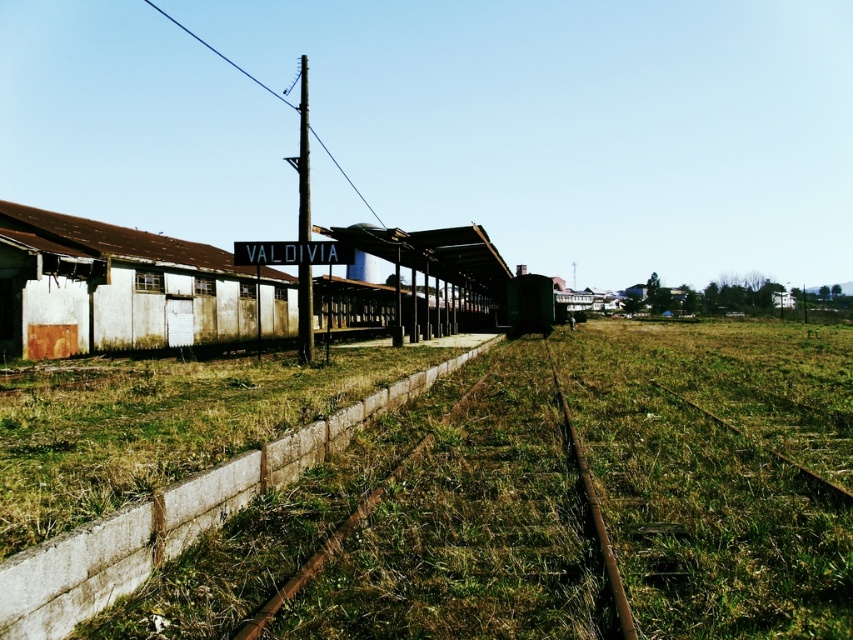
You are standing at the abandoned Valdivia railway station. You see a metallic pole at center and a rusty metal train track at center. Which object is positioned to the left when viewed from your perspective?

The metallic pole at center is to the left of the rusty metal train track at center.

You are a maintenance worker checking the abandoned railway station. You notice the metallic pole at center and the rusty metal train track at center. Which object is bigger in size?

The metallic pole at center is larger in size compared to the rusty metal train track at center.